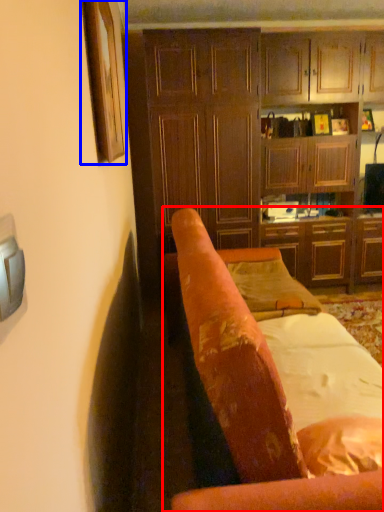
Question: Which object is further to the camera taking this photo, chair (highlighted by a red box) or picture frame (highlighted by a blue box)?

Choices:
 (A) chair
 (B) picture frame

Answer: (B)